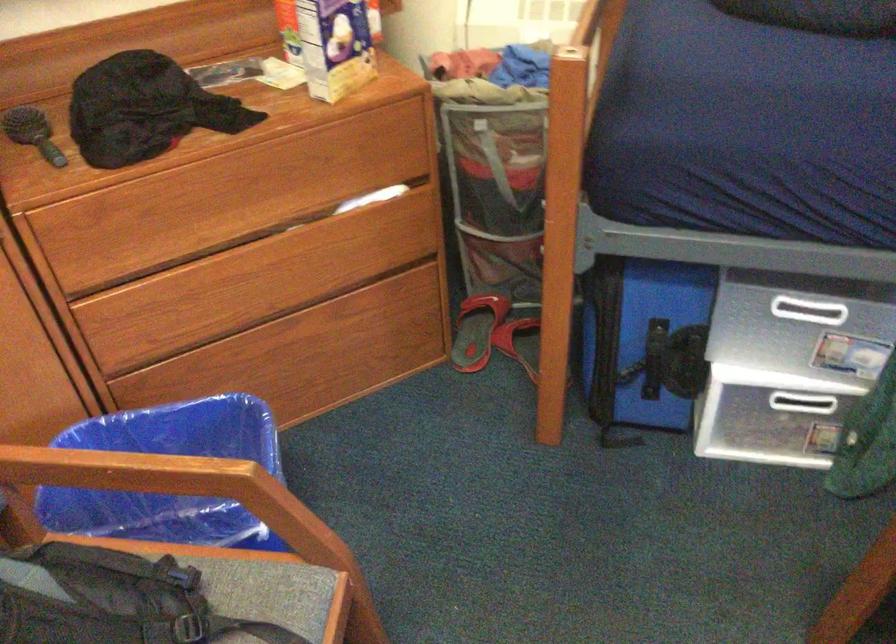
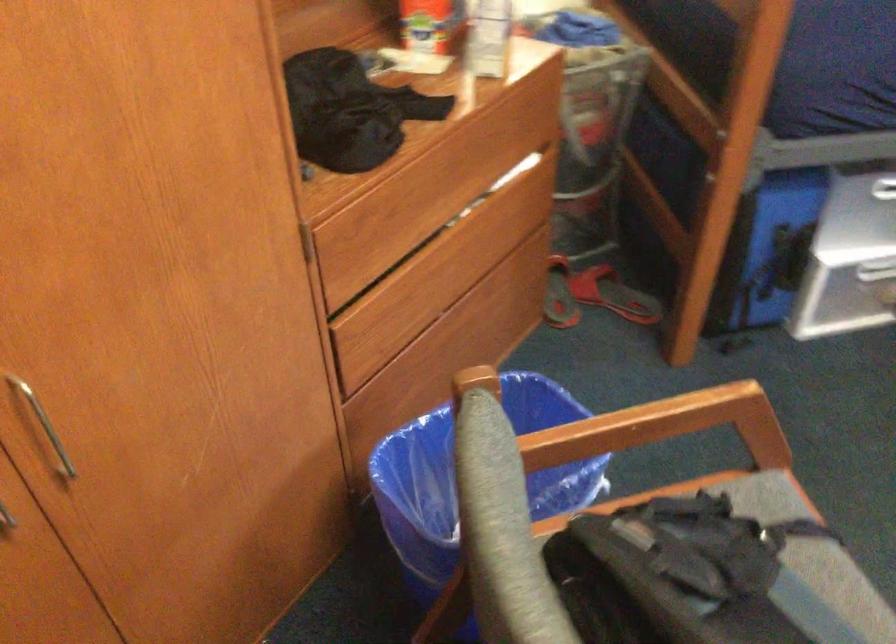
Question: The camera is either moving clockwise (left) or counter-clockwise (right) around the object. The first image is from the beginning of the video and the second image is from the end. Is the camera moving left or right when shooting the video?

Choices:
 (A) Left
 (B) Right

Answer: (A)